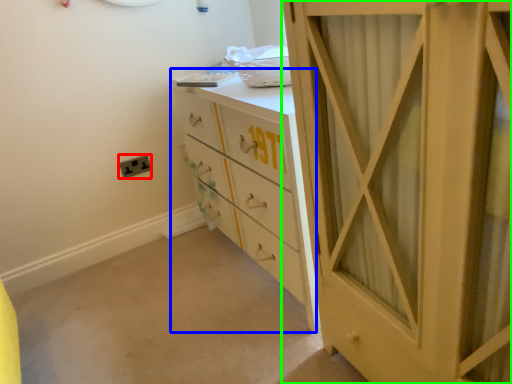
Question: Which is farther away from electric outlet (highlighted by a red box)? chest of drawers (highlighted by a blue box) or cupboard (highlighted by a green box)?

Choices:
 (A) chest of drawers
 (B) cupboard

Answer: (B)